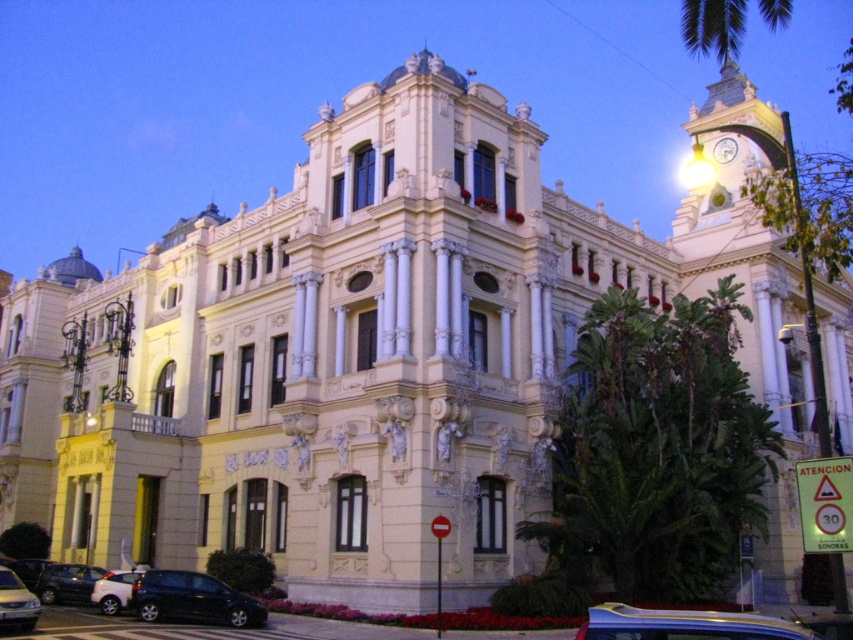
Can you confirm if gold textured clock tower at upper right is wider than metallic clock at upper right?

Correct, the width of gold textured clock tower at upper right exceeds that of metallic clock at upper right.

Does gold textured clock tower at upper right have a lesser width compared to metallic clock at upper right?

In fact, gold textured clock tower at upper right might be wider than metallic clock at upper right.

The image size is (853, 640). Describe the element at coordinates (792, 243) in the screenshot. I see `gold textured clock tower at upper right` at that location.

Where is `gold textured clock tower at upper right`? Image resolution: width=853 pixels, height=640 pixels. gold textured clock tower at upper right is located at coordinates pos(792,243).

Find the location of a particular element. The height and width of the screenshot is (640, 853). shiny black hatchback at lower left is located at coordinates (192, 600).

Does shiny black hatchback at lower left appear on the right side of white matte car at lower left?

Yes, shiny black hatchback at lower left is to the right of white matte car at lower left.

Find the location of a particular element. Image resolution: width=853 pixels, height=640 pixels. shiny black hatchback at lower left is located at coordinates (192, 600).

Locate an element on the screen. The width and height of the screenshot is (853, 640). shiny black hatchback at lower left is located at coordinates (192, 600).

Who is positioned more to the right, dark gray metallic car at lower left or metallic silver car at lower left?

Positioned to the right is metallic silver car at lower left.

Does dark gray metallic car at lower left lie behind metallic silver car at lower left?

Yes, dark gray metallic car at lower left is further from the viewer.

Where is `dark gray metallic car at lower left`? The width and height of the screenshot is (853, 640). dark gray metallic car at lower left is located at coordinates (67, 582).